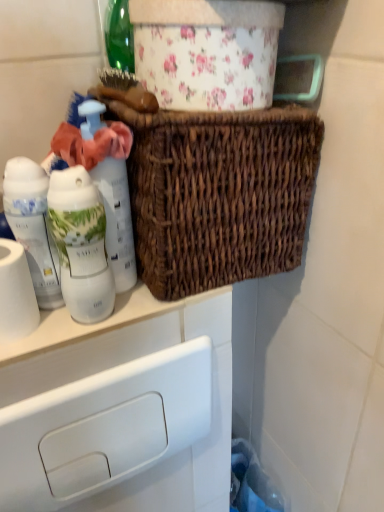
Question: From a real-world perspective, relative to white glossy lotion at left, placed as the 3th bottle when sorted from right to left, is white matte toilet paper at left vertically above or below?

Choices:
 (A) above
 (B) below

Answer: (B)

Question: Relative to white glossy lotion at left, placed as the 3th bottle when sorted from right to left, is white matte toilet paper at left in front or behind?

Choices:
 (A) behind
 (B) front

Answer: (B)

Question: Which is farther from the white glossy bottle at left, arranged as the second bottle when viewed from the left?

Choices:
 (A) white matte toilet paper at left
 (B) white plastic drawer at lower left
 (C) white glossy lotion at left, placed as the 3th bottle when sorted from right to left
 (D) woven brown basket at upper center
 (E) white matte bottle at left, marked as the 1th bottle in a right-to-left arrangement

Answer: (B)

Question: Which is nearer to the woven brown basket at upper center?

Choices:
 (A) white plastic drawer at lower left
 (B) white matte toilet paper at left
 (C) white matte bottle at left, the third bottle from the left
 (D) white glossy bottle at left, positioned as the second bottle in right-to-left order
 (E) white glossy lotion at left, placed as the 3th bottle when sorted from right to left

Answer: (C)